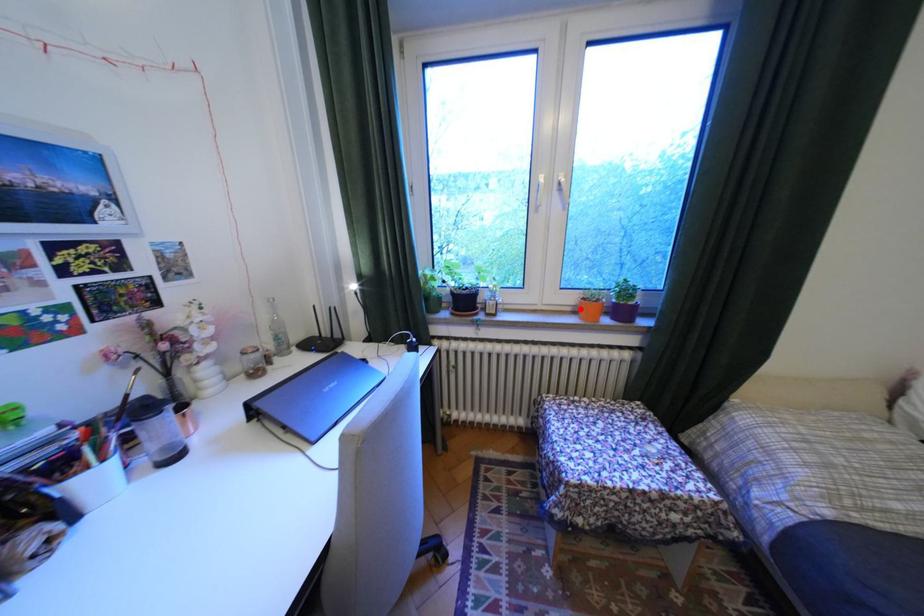
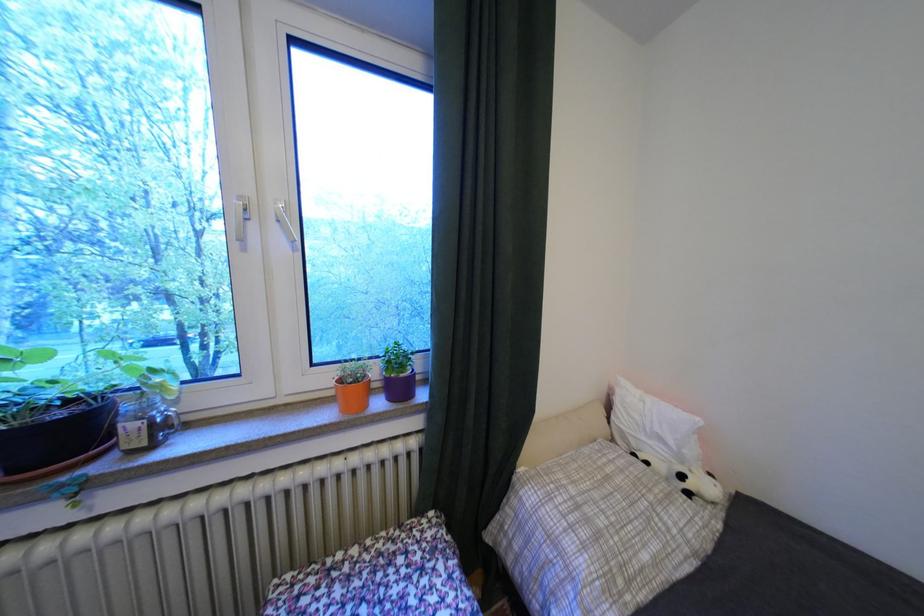
Locate, in the second image, the point that corresponds to the highlighted location in the first image.

(343, 392)